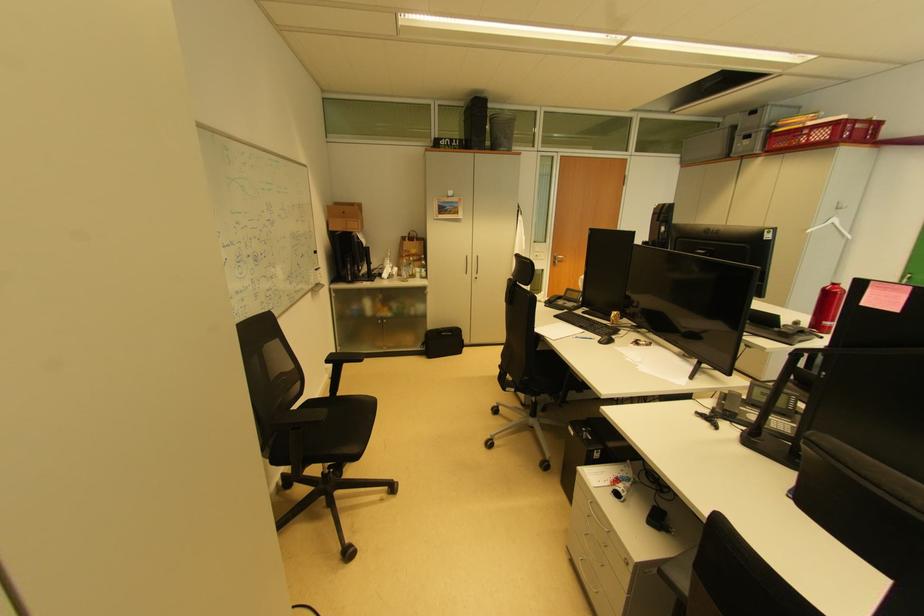
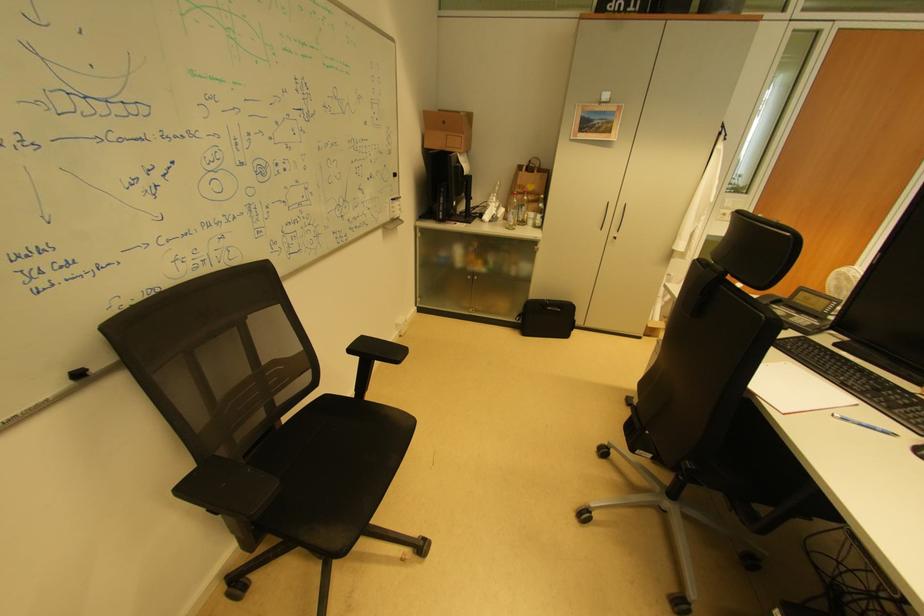
The point at (335, 363) is marked in the first image. Where is the corresponding point in the second image?

(359, 352)